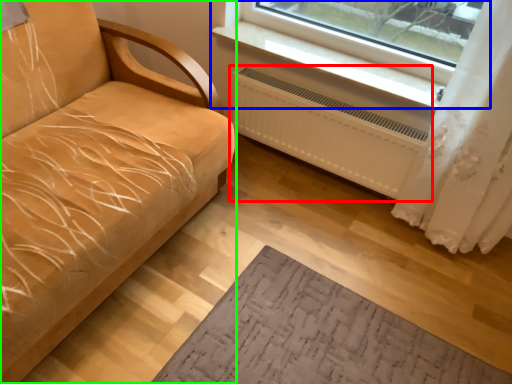
Question: Considering the real-world distances, which object is closest to radiator (highlighted by a red box)? window (highlighted by a blue box) or studio couch (highlighted by a green box).

Choices:
 (A) window
 (B) studio couch

Answer: (A)